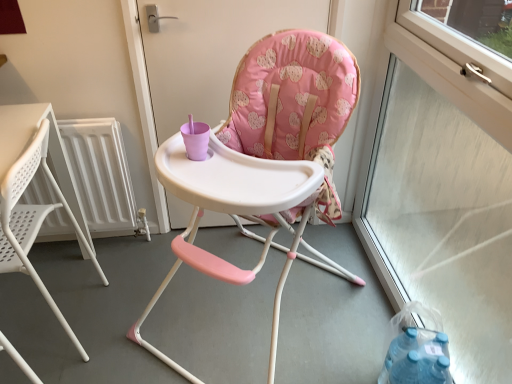
Image resolution: width=512 pixels, height=384 pixels. I want to click on free area below white metallic radiator at left (from a real-world perspective), so click(x=94, y=244).